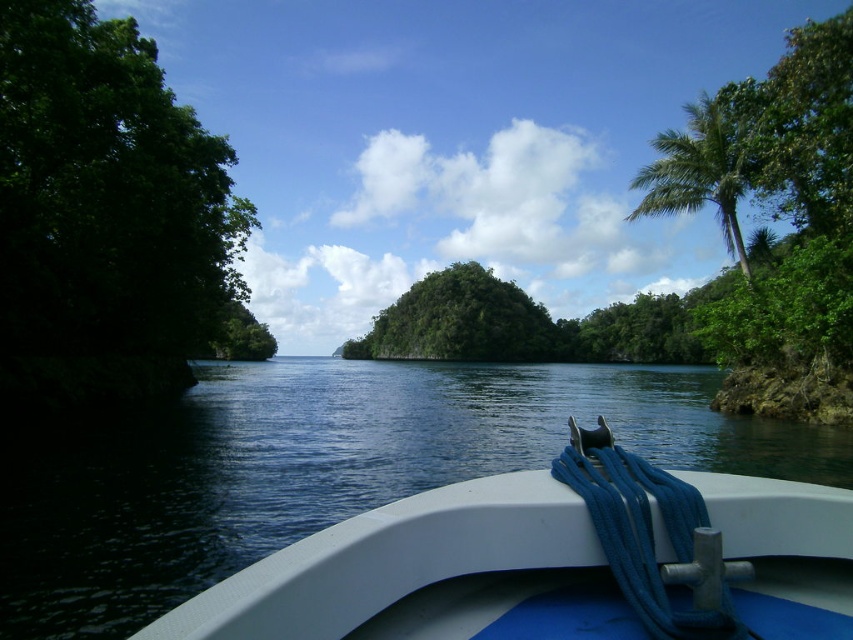
In the scene shown: Which is above, white plastic boat at lower center or green leafy tree at left?

green leafy tree at left

What do you see at coordinates (555, 561) in the screenshot? The image size is (853, 640). I see `white plastic boat at lower center` at bounding box center [555, 561].

What are the coordinates of `white plastic boat at lower center` in the screenshot? It's located at (555, 561).

Can you confirm if green leafy island at center is shorter than green leafy palm tree at upper right?

Indeed, green leafy island at center has a lesser height compared to green leafy palm tree at upper right.

Locate an element on the screen. The width and height of the screenshot is (853, 640). green leafy island at center is located at coordinates (461, 321).

Can you confirm if white plastic boat at lower center is thinner than green leafy palm tree at upper right?

Yes.

Is point (614, 620) more distant than point (724, 141)?

No, it is not.

Locate an element on the screen. This screenshot has height=640, width=853. white plastic boat at lower center is located at coordinates (555, 561).